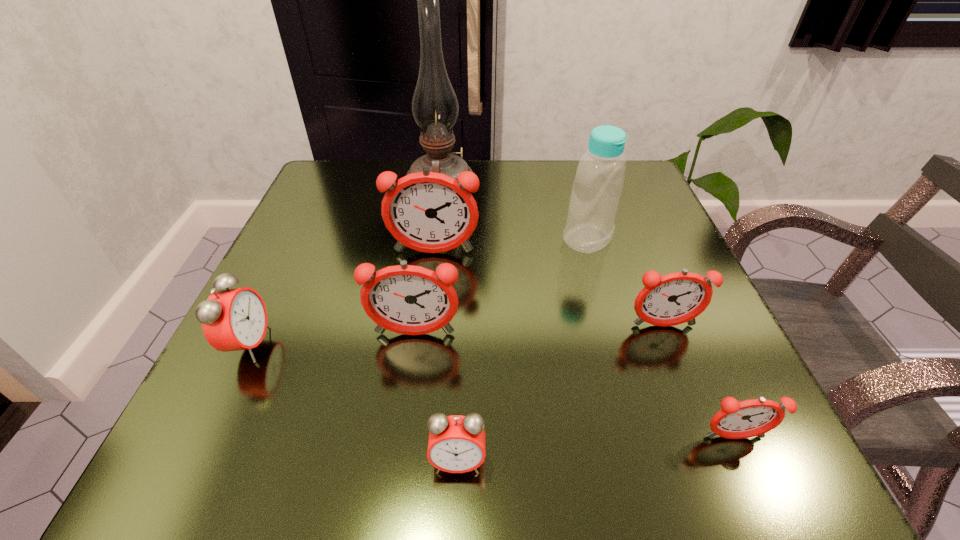
Find the location of a particular element. unoccupied position between the biggest reddish-pink alarm clock and the nearer red alarm clock is located at coordinates (445, 357).

This screenshot has width=960, height=540. I want to click on free space between the farthest object and the nearest reddish-pink alarm clock, so click(587, 309).

Locate an element on the screen. The image size is (960, 540). object that is the second closest to the blue bottle is located at coordinates (430, 212).

Point out which object is positioned as the nearest to the nearer red alarm clock. Please provide its 2D coordinates. Your answer should be formatted as a tuple, i.e. [(x, y)], where the tuple contains the x and y coordinates of a point satisfying the conditions above.

[(405, 299)]

You are a GUI agent. You are given a task and a screenshot of the screen. Output one action in this format:
    pyautogui.click(x=<x>, y=<y>)
    Task: Click on the closest alarm clock to the smallest reddish-pink alarm clock
    Image resolution: width=960 pixels, height=540 pixels.
    Given the screenshot: What is the action you would take?
    pyautogui.click(x=676, y=298)

At what (x,y) coordinates should I click in order to perform the action: click on the sixth closest alarm clock relative to the oil lamp. Please return your answer as a coordinate pair (x, y). Looking at the image, I should click on coord(736,420).

Locate which reddish-pink alarm clock is the closest to the second tallest object. Please provide its 2D coordinates. Your answer should be formatted as a tuple, i.e. [(x, y)], where the tuple contains the x and y coordinates of a point satisfying the conditions above.

[(676, 298)]

Where is `reddish-pink alarm clock that can be found as the closest to the blue bottle`? reddish-pink alarm clock that can be found as the closest to the blue bottle is located at coordinates (676, 298).

Identify the location of vacant space that satisfies the following two spatial constraints: 1. on the front-facing side of the fifth shortest alarm clock; 2. on the front-facing side of the left red alarm clock. (413, 345).

Find the location of a particular element. This screenshot has height=540, width=960. free space that satisfies the following two spatial constraints: 1. on the front-facing side of the third biggest reddish-pink alarm clock; 2. on the front-facing side of the bigger red alarm clock is located at coordinates (671, 345).